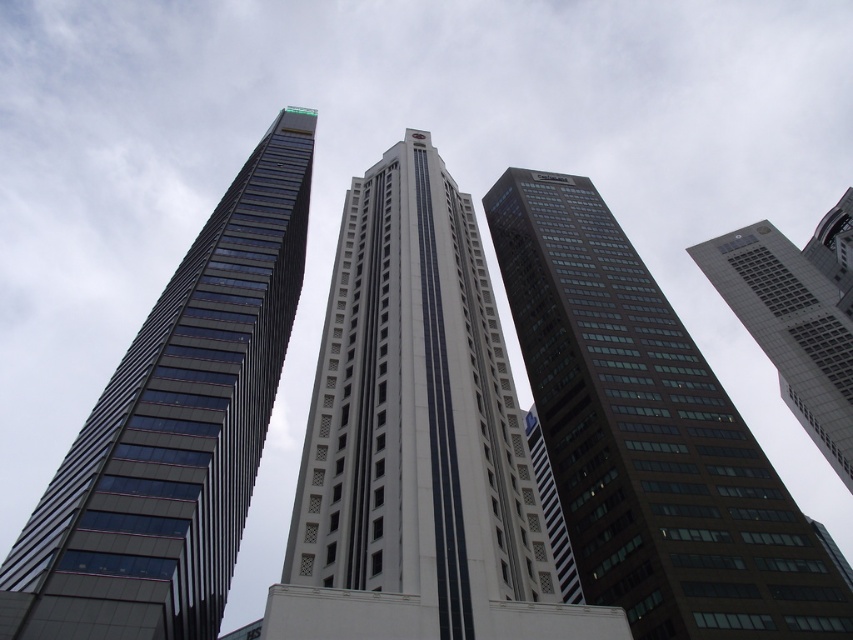
Locate an element on the screen. glassy reflective skyscraper at center is located at coordinates [x=416, y=440].

Can you confirm if glassy reflective skyscraper at center is positioned to the left of brown glass building at center?

Indeed, glassy reflective skyscraper at center is positioned on the left side of brown glass building at center.

You are a GUI agent. You are given a task and a screenshot of the screen. Output one action in this format:
    pyautogui.click(x=<x>, y=<y>)
    Task: Click on the glassy reflective skyscraper at center
    The image size is (853, 640).
    Given the screenshot: What is the action you would take?
    coord(416,440)

This screenshot has width=853, height=640. Find the location of `glassy reflective skyscraper at center`. glassy reflective skyscraper at center is located at coordinates (416, 440).

Does brown glass building at center have a larger size compared to glassy reflective skyscraper at left?

No, brown glass building at center is not bigger than glassy reflective skyscraper at left.

Is brown glass building at center above glassy reflective skyscraper at left?

Actually, brown glass building at center is below glassy reflective skyscraper at left.

Is point (717, 428) farther from camera compared to point (196, 605)?

That is True.

Image resolution: width=853 pixels, height=640 pixels. I want to click on brown glass building at center, so click(648, 436).